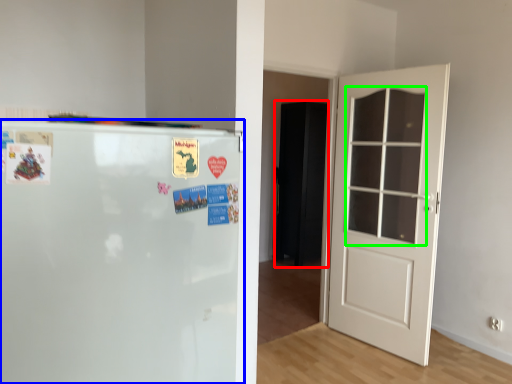
Question: Considering the real-world distances, which object is farthest from armoire (highlighted by a red box)? refrigerator (highlighted by a blue box) or window (highlighted by a green box)?

Choices:
 (A) refrigerator
 (B) window

Answer: (A)